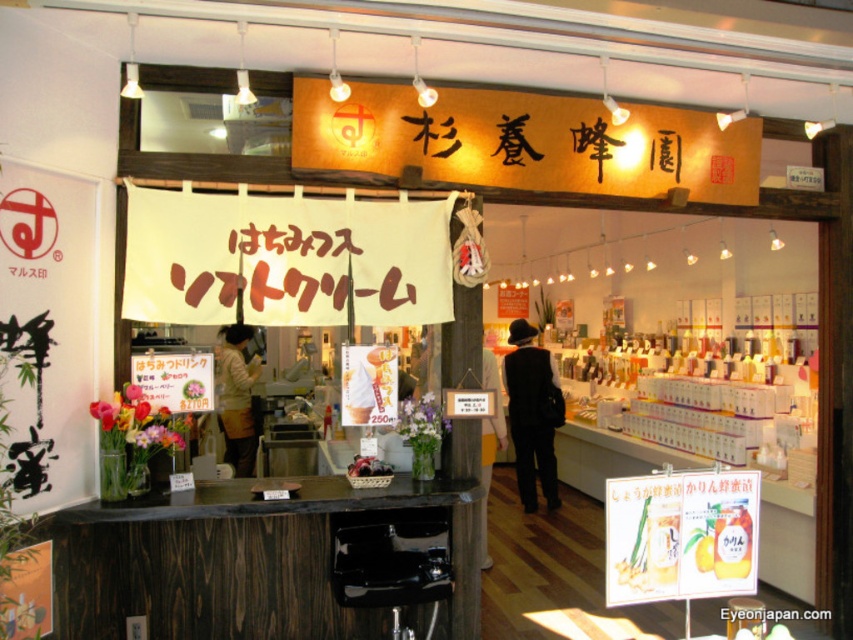
Identify the location of light beige fabric jacket at center. (236, 397).

Between light beige fabric jacket at center and black fabric at center, which one has less height?

light beige fabric jacket at center

What do you see at coordinates (236, 397) in the screenshot? I see `light beige fabric jacket at center` at bounding box center [236, 397].

The width and height of the screenshot is (853, 640). Find the location of `light beige fabric jacket at center`. light beige fabric jacket at center is located at coordinates (236, 397).

Is black fabric coat at center positioned before black fabric at center?

No, black fabric coat at center is further to the viewer.

Does black fabric coat at center appear under black fabric at center?

Incorrect, black fabric coat at center is not positioned below black fabric at center.

Is point (509, 353) positioned after point (498, 388)?

Yes.

Identify the location of black fabric coat at center. (531, 413).

Who is positioned more to the left, black fabric coat at center or light beige fabric jacket at center?

light beige fabric jacket at center

Who is more forward, (511, 349) or (227, 420)?

Point (227, 420) is more forward.

Is point (515, 358) farther from camera compared to point (253, 460)?

Yes, point (515, 358) is behind point (253, 460).

The image size is (853, 640). Find the location of `black fabric coat at center`. black fabric coat at center is located at coordinates (531, 413).